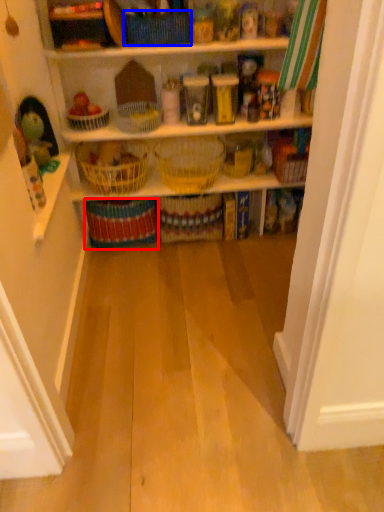
Question: Which object appears closest to the camera in this image, basket (highlighted by a red box) or basket (highlighted by a blue box)?

Choices:
 (A) basket
 (B) basket

Answer: (B)